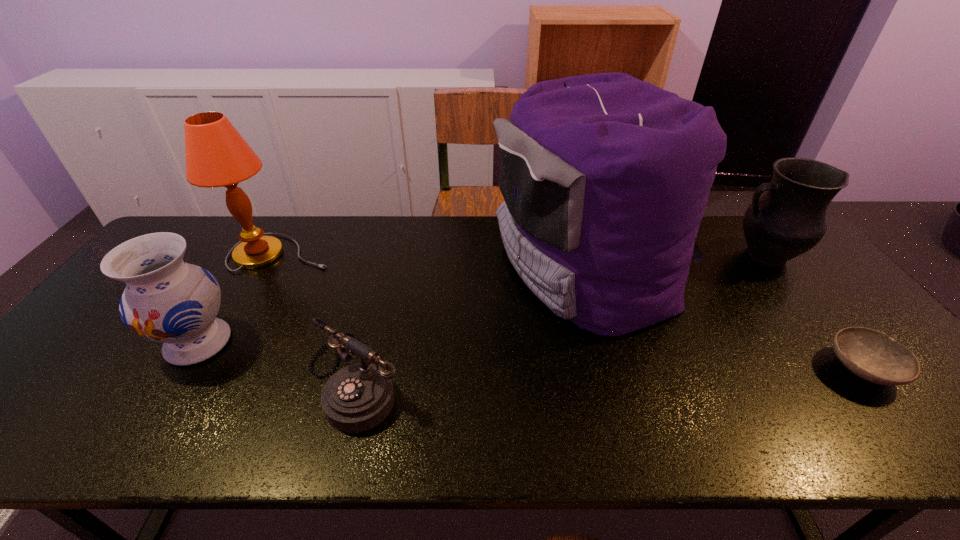
The width and height of the screenshot is (960, 540). In order to click on vacant area situated on the front pocket of the tallest object in this screenshot , I will do tap(402, 268).

Find the location of a particular element. Image resolution: width=960 pixels, height=540 pixels. free location located 0.310m on the front of the fifth shortest object is located at coordinates (225, 356).

Locate an element on the screen. The image size is (960, 540). vacant space situated 0.100m on the handle side of the pitcher is located at coordinates (696, 255).

The height and width of the screenshot is (540, 960). Identify the location of free spot located on the handle side of the pitcher. (652, 255).

Locate an element on the screen. This screenshot has width=960, height=540. free space located 0.090m on the handle side of the pitcher is located at coordinates (699, 255).

Identify the location of vacant space located on the right of the vase. The width and height of the screenshot is (960, 540). (345, 343).

Image resolution: width=960 pixels, height=540 pixels. Find the location of `free space located 0.360m on the back of the second shortest object`. free space located 0.360m on the back of the second shortest object is located at coordinates (389, 249).

Identify the location of vacant space located 0.250m on the left of the bowl. (723, 369).

Where is `backpack located at the far edge`? The image size is (960, 540). backpack located at the far edge is located at coordinates (605, 177).

Locate an element on the screen. The width and height of the screenshot is (960, 540). lamp at the far edge is located at coordinates (217, 155).